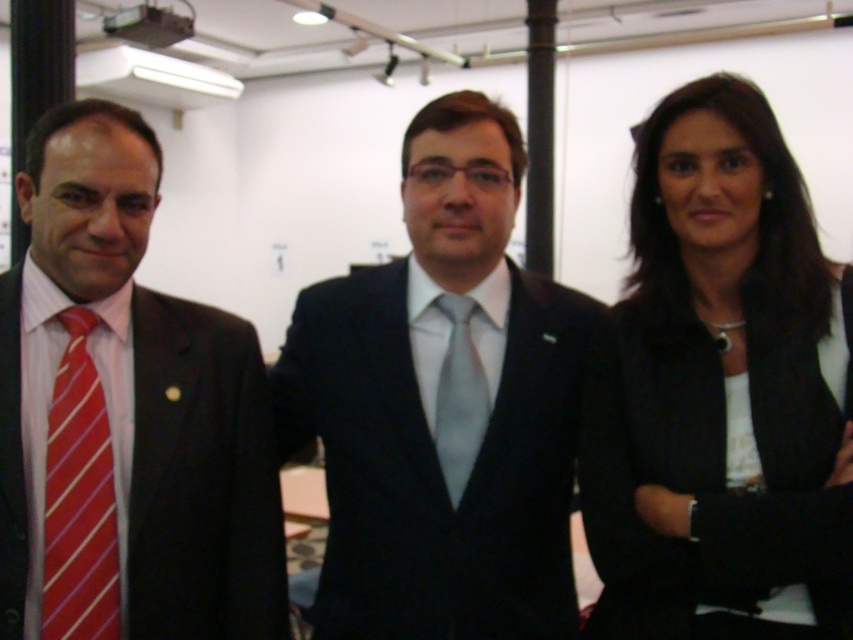
Question: Estimate the real-world distances between objects in this image. Which object is farther from the light gray silk tie at center?

Choices:
 (A) red striped tie at left
 (B) black matte blazer at center
 (C) matte black suit at center

Answer: (A)

Question: From the image, what is the correct spatial relationship of matte black suit at left in relation to light gray silk tie at center?

Choices:
 (A) above
 (B) below

Answer: (A)

Question: Based on their relative distances, which object is nearer to the red striped tie at left?

Choices:
 (A) light gray silk tie at center
 (B) matte black suit at left
 (C) matte black suit at center
 (D) black matte blazer at center

Answer: (B)

Question: Does matte black suit at left appear on the left side of red striped tie at left?

Choices:
 (A) yes
 (B) no

Answer: (B)

Question: Is black matte blazer at center smaller than matte black suit at left?

Choices:
 (A) no
 (B) yes

Answer: (B)

Question: Which is farther from the matte black suit at center?

Choices:
 (A) red striped tie at left
 (B) black matte blazer at center
 (C) light gray silk tie at center

Answer: (A)